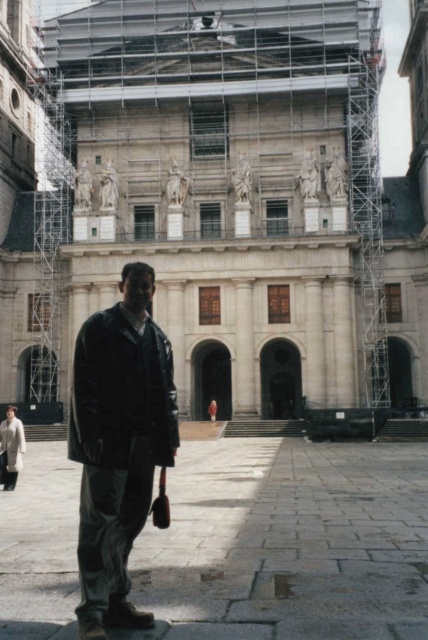
Does smooth stone courtyard at center appear under dark matte jacket at center?

Yes.

From the picture: Does smooth stone courtyard at center appear on the left side of dark matte jacket at center?

In fact, smooth stone courtyard at center is to the right of dark matte jacket at center.

This screenshot has width=428, height=640. What do you see at coordinates (288, 541) in the screenshot? I see `smooth stone courtyard at center` at bounding box center [288, 541].

Locate an element on the screen. smooth stone courtyard at center is located at coordinates (288, 541).

Based on the photo, is white marble palace at center taller than dark matte jacket at center?

Indeed, white marble palace at center has a greater height compared to dark matte jacket at center.

Can you confirm if white marble palace at center is smaller than dark matte jacket at center?

No.

This screenshot has height=640, width=428. I want to click on white marble palace at center, so click(x=222, y=204).

Where is `white marble palace at center`? Image resolution: width=428 pixels, height=640 pixels. white marble palace at center is located at coordinates (222, 204).

Between white marble palace at center and smooth stone courtyard at center, which one is positioned higher?

Positioned higher is white marble palace at center.

Who is more forward, (416, 406) or (175, 592)?

Point (175, 592) is in front.

What are the coordinates of `white marble palace at center` in the screenshot? It's located at (222, 204).